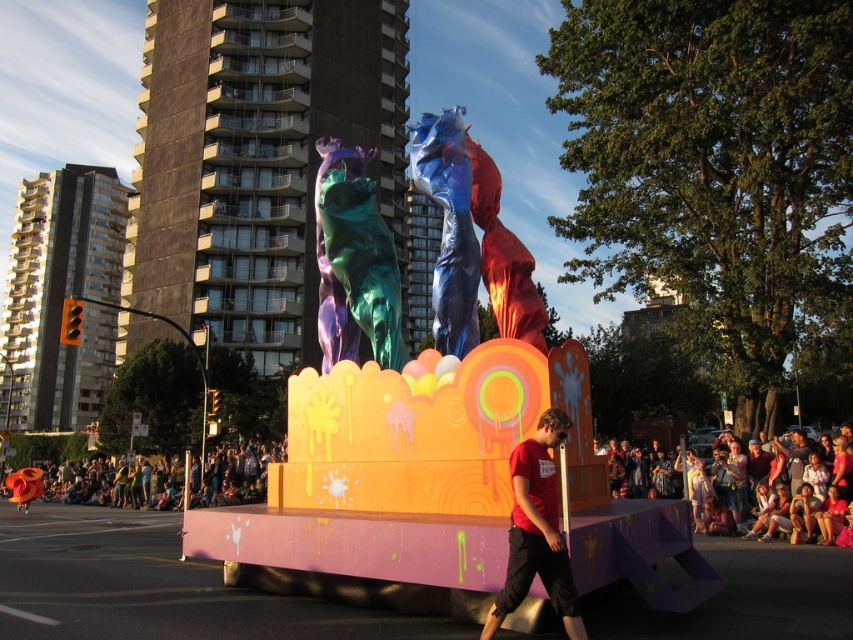
Question: Among these points, which one is nearest to the camera?

Choices:
 (A) (526, 548)
 (B) (808, 502)
 (C) (231, 456)

Answer: (A)

Question: Which point is closer to the camera?

Choices:
 (A) 546,528
 (B) 361,173
 (C) 221,448
 (D) 824,506

Answer: (A)

Question: Does multicolored fabric crowd at lower center appear over matte pink fabric at lower right?

Choices:
 (A) yes
 (B) no

Answer: (B)

Question: Is red matte t-shirt at center bigger than multicolored fabric crowd at lower center?

Choices:
 (A) yes
 (B) no

Answer: (B)

Question: Is metallic teal bear at center behind red matte t-shirt at center?

Choices:
 (A) yes
 (B) no

Answer: (A)

Question: Which object appears farthest from the camera in this image?

Choices:
 (A) multicolored fabric crowd at lower center
 (B) metallic teal bear at center
 (C) matte pink fabric at lower right

Answer: (A)